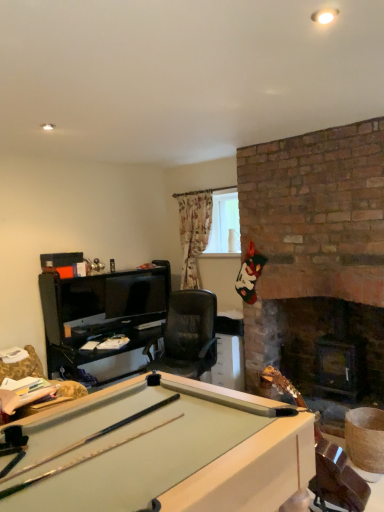
Measure the distance between wooden cue stick at lower right and camera.

They are 2.22 meters apart.

Where is `wooden cue stick at lower right`? wooden cue stick at lower right is located at coordinates 336,478.

How much distance is there between clear glass window at upper center and black leather swivel chair at lower left?

They are 2.33 meters apart.

Do you think clear glass window at upper center is within black leather swivel chair at lower left, or outside of it?

clear glass window at upper center is not inside black leather swivel chair at lower left, it's outside.

Does clear glass window at upper center touch black leather swivel chair at lower left?

No.

Based on the photo, from a real-world perspective, between clear glass window at upper center and black leather swivel chair at lower left, who is vertically higher?

clear glass window at upper center.

From the image's perspective, would you say clear glass window at upper center is positioned over wooden cue stick at lower right?

Yes.

Can you tell me how much clear glass window at upper center and wooden cue stick at lower right differ in facing direction?

They differ by 1.3 degrees in their facing directions.

Consider the image. Choose the correct answer: Is clear glass window at upper center inside wooden cue stick at lower right or outside it?

clear glass window at upper center cannot be found inside wooden cue stick at lower right.

Is clear glass window at upper center at the left side of wooden cue stick at lower right?

Indeed, clear glass window at upper center is positioned on the left side of wooden cue stick at lower right.

From the image's perspective, is black leather swivel chair at lower left below wooden cue stick at lower right?

Incorrect, from the image's perspective, black leather swivel chair at lower left is higher than wooden cue stick at lower right.

Which object is positioned more to the right, black leather swivel chair at lower left or wooden cue stick at lower right?

wooden cue stick at lower right is more to the right.

Which of these two, black leather swivel chair at lower left or wooden cue stick at lower right, is thinner?

Thinner between the two is black leather swivel chair at lower left.

Relative to clear glass window at upper center, is black leather swivel chair at lower left in front or behind?

black leather swivel chair at lower left is positioned closer to the viewer than clear glass window at upper center.

Is black leather swivel chair at lower left to the left of clear glass window at upper center from the viewer's perspective?

Indeed, black leather swivel chair at lower left is positioned on the left side of clear glass window at upper center.

Is black leather swivel chair at lower left wider or thinner than clear glass window at upper center?

Clearly, black leather swivel chair at lower left has more width compared to clear glass window at upper center.

Is black leather swivel chair at lower left turned away from clear glass window at upper center?

No, black leather swivel chair at lower left is not facing the opposite direction of clear glass window at upper center.

Is wooden cue stick at lower right oriented away from clear glass window at upper center?

No, wooden cue stick at lower right is not facing the opposite direction of clear glass window at upper center.

Is wooden cue stick at lower right beside clear glass window at upper center?

No, wooden cue stick at lower right is not in contact with clear glass window at upper center.

From a real-world perspective, between wooden cue stick at lower right and clear glass window at upper center, who is vertically lower?

In real-world perspective, wooden cue stick at lower right is lower.

Measure the distance from wooden cue stick at lower right to clear glass window at upper center.

They are 2.80 meters apart.

From a real-world perspective, is wooden cue stick at lower right beneath black leather swivel chair at lower left?

Yes, from a real-world perspective, wooden cue stick at lower right is below black leather swivel chair at lower left.

Is wooden cue stick at lower right bigger or smaller than black leather swivel chair at lower left?

Clearly, wooden cue stick at lower right is larger in size than black leather swivel chair at lower left.

From the image's perspective, which is above, wooden cue stick at lower right or black leather swivel chair at lower left?

From the image's view, black leather swivel chair at lower left is above.

Could black leather swivel chair at lower left be considered to be inside wooden cue stick at lower right?

No.

Find the location of a particular element. window screen behind the black leather swivel chair at lower left is located at coordinates (224, 224).

Where is `equipment below the clear glass window at upper center (from a real-world perspective)`? Image resolution: width=384 pixels, height=512 pixels. equipment below the clear glass window at upper center (from a real-world perspective) is located at coordinates (336, 478).

Estimate the real-world distances between objects in this image. Which object is further from wooden cue stick at lower right, black leather swivel chair at lower left or clear glass window at upper center?

clear glass window at upper center lies further to wooden cue stick at lower right than the other object.

Estimate the real-world distances between objects in this image. Which object is closer to clear glass window at upper center, black leather swivel chair at lower left or wooden cue stick at lower right?

Answer: black leather swivel chair at lower left.

In the scene shown: Based on their spatial positions, is wooden cue stick at lower right or clear glass window at upper center further from black leather swivel chair at lower left?

wooden cue stick at lower right is further to black leather swivel chair at lower left.

Which object lies nearer to the anchor point wooden cue stick at lower right, clear glass window at upper center or black leather swivel chair at lower left?

black leather swivel chair at lower left.

Looking at the image, which one is located closer to clear glass window at upper center, wooden cue stick at lower right or black leather swivel chair at lower left?

Based on the image, black leather swivel chair at lower left appears to be nearer to clear glass window at upper center.

From the image, which object appears to be farther from black leather swivel chair at lower left, clear glass window at upper center or wooden cue stick at lower right?

wooden cue stick at lower right is further to black leather swivel chair at lower left.

At what (x,y) coordinates should I click in order to perform the action: click on swivel chair between wooden cue stick at lower right and clear glass window at upper center along the z-axis. Please return your answer as a coordinate pair (x, y). Looking at the image, I should click on (23, 366).